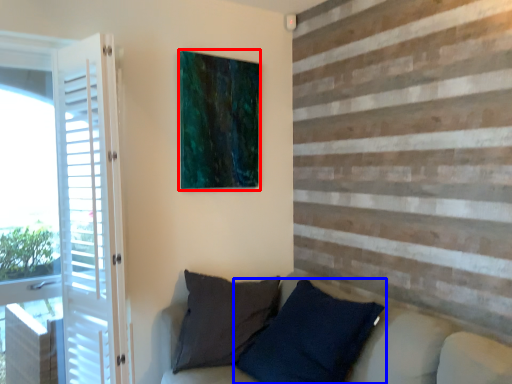
Question: Which object appears closest to the camera in this image, picture frame (highlighted by a red box) or pillow (highlighted by a blue box)?

Choices:
 (A) picture frame
 (B) pillow

Answer: (B)